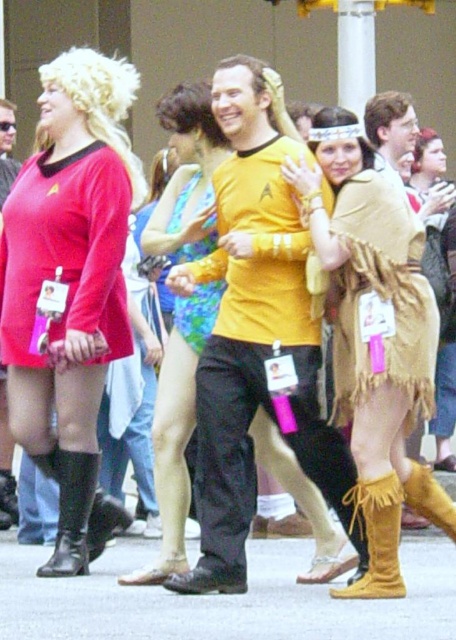
Which of these two, yellow matte shirt at center or matte black dress at left, stands taller?

matte black dress at left

Who is more forward, (243, 403) or (4, 516)?

Point (243, 403) is more forward.

Identify the location of yellow matte shirt at center. (253, 333).

Does tan suede skirt at center have a lesser width compared to matte black dress at left?

No, tan suede skirt at center is not thinner than matte black dress at left.

Between point (315, 218) and point (5, 164), which one is positioned behind?

Positioned behind is point (5, 164).

At what (x,y) coordinates should I click in order to perform the action: click on tan suede skirt at center. Please return your answer as a coordinate pair (x, y). Image resolution: width=456 pixels, height=640 pixels. Looking at the image, I should click on (374, 340).

Is matte red uniform at left wider than matte black dress at left?

Yes, matte red uniform at left is wider than matte black dress at left.

Which is more to the right, matte red uniform at left or matte black dress at left?

Positioned to the right is matte red uniform at left.

Between point (1, 275) and point (5, 397), which one is positioned behind?

Positioned behind is point (5, 397).

Identify the location of matte red uniform at left. (66, 250).